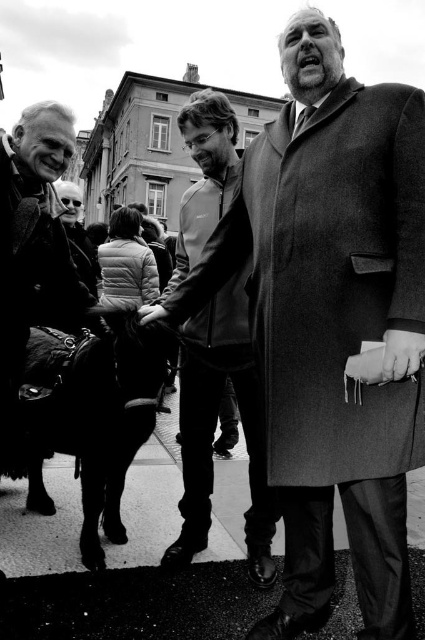
Is point (343, 445) positioned in front of point (62, 180)?

Yes, point (343, 445) is closer to viewer.

Between smooth wool coat at center and gray wool coat at center, which one is positioned lower?

Positioned lower is smooth wool coat at center.

Where is `smooth wool coat at center`? This screenshot has width=425, height=640. smooth wool coat at center is located at coordinates (337, 280).

Measure the distance between smooth gray coat at right and camera.

smooth gray coat at right and camera are 38.42 meters apart.

Is point (314, 260) closer to viewer compared to point (246, 516)?

Yes, it is.

Identify the location of smooth gray coat at right. (333, 321).

What do you see at coordinates (33, 253) in the screenshot?
I see `leather jacket at left` at bounding box center [33, 253].

What do you see at coordinates (33, 253) in the screenshot? I see `leather jacket at left` at bounding box center [33, 253].

Identify the location of leather jacket at left. 33,253.